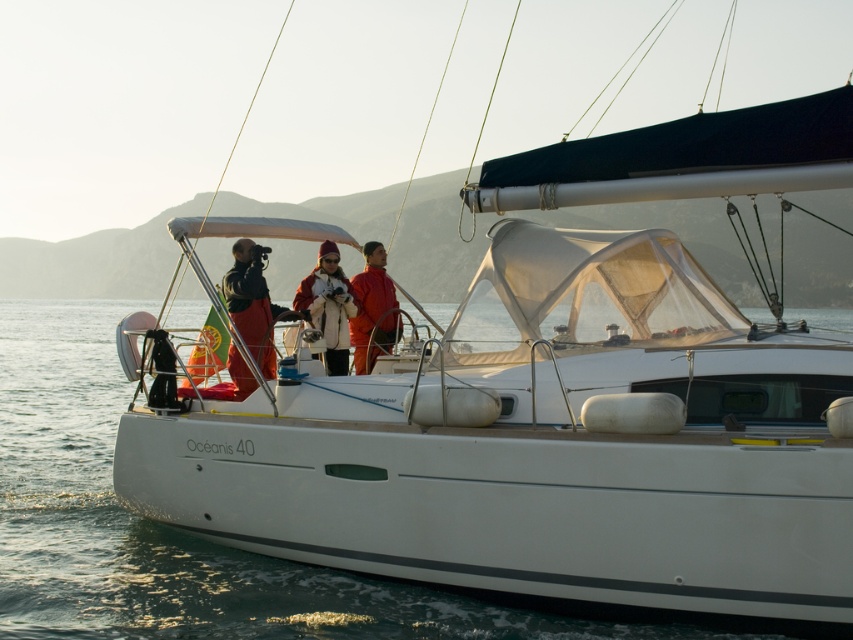
Does dark brown leather jacket at center have a smaller size compared to matte orange jacket at center?

No.

Who is more forward, (265, 356) or (372, 248)?

Point (265, 356) is in front.

Image resolution: width=853 pixels, height=640 pixels. Describe the element at coordinates (251, 304) in the screenshot. I see `dark brown leather jacket at center` at that location.

The width and height of the screenshot is (853, 640). I want to click on dark brown leather jacket at center, so click(x=251, y=304).

Which is more to the left, clear water at center or matte orange jacket at center?

matte orange jacket at center is more to the left.

Between point (88, 520) and point (381, 248), which one is positioned in front?

Point (381, 248)

The width and height of the screenshot is (853, 640). Find the location of `clear water at center`. clear water at center is located at coordinates [171, 529].

Is point (84, 547) more distant than point (258, 244)?

Yes, point (84, 547) is farther from viewer.

Which is behind, point (184, 632) or point (258, 262)?

The point (258, 262) is behind.

Identify the location of clear water at center. The height and width of the screenshot is (640, 853). (171, 529).